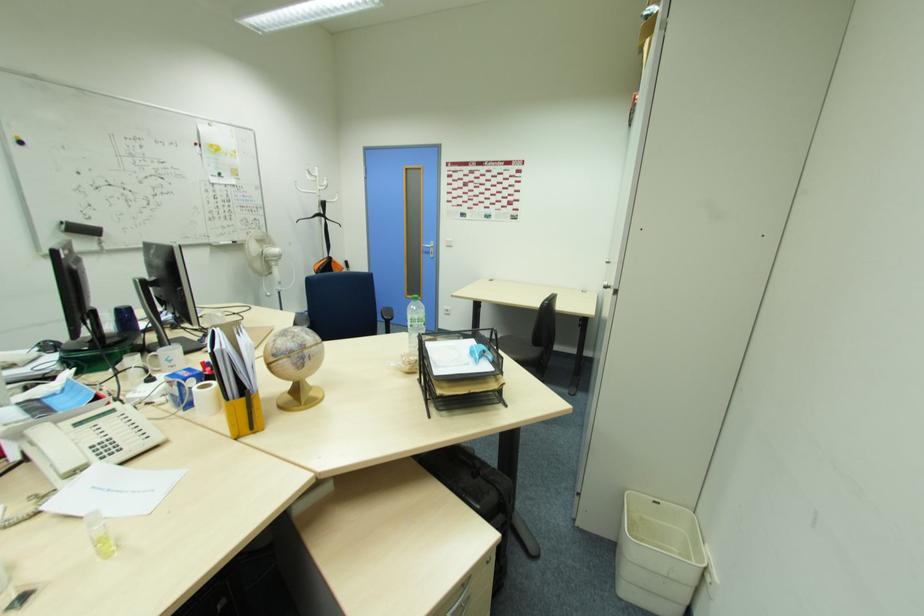
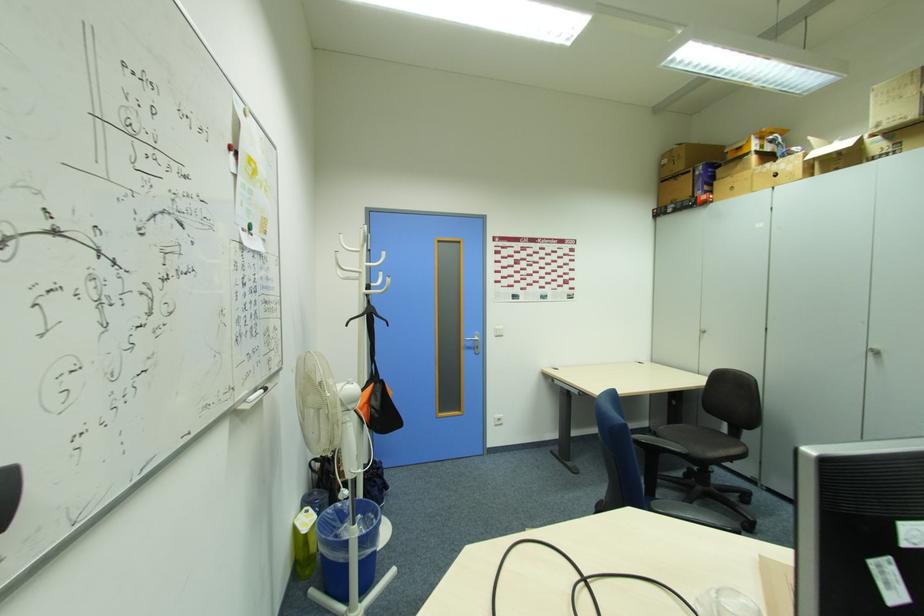
Where in the second image is the point corresponding to point 430,252 from the first image?

(472, 346)